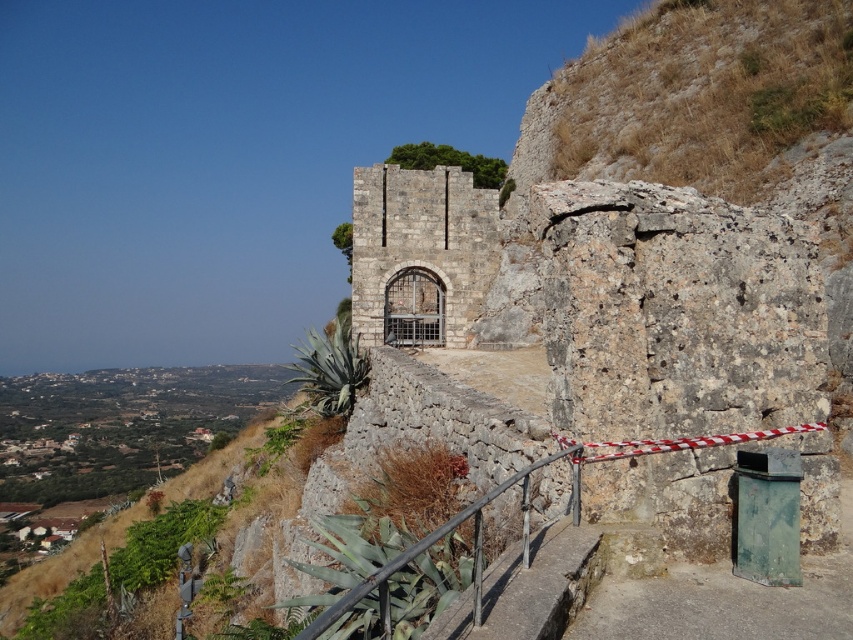
You are a tour guide explaining the historical site to visitors. You want to mention the size comparison between the rustic stone gate at center and the rustic metal railing at center. How would you describe their sizes?

The rustic stone gate at center is larger in size than the rustic metal railing at center.

You are a tour guide explaining the historical site to visitors. You point out the rustic stone gate at center and the rustic metal railing at center. Which one has a narrower width?

The rustic stone gate at center is thinner than the rustic metal railing at center, so the rustic stone gate at center has a narrower width.